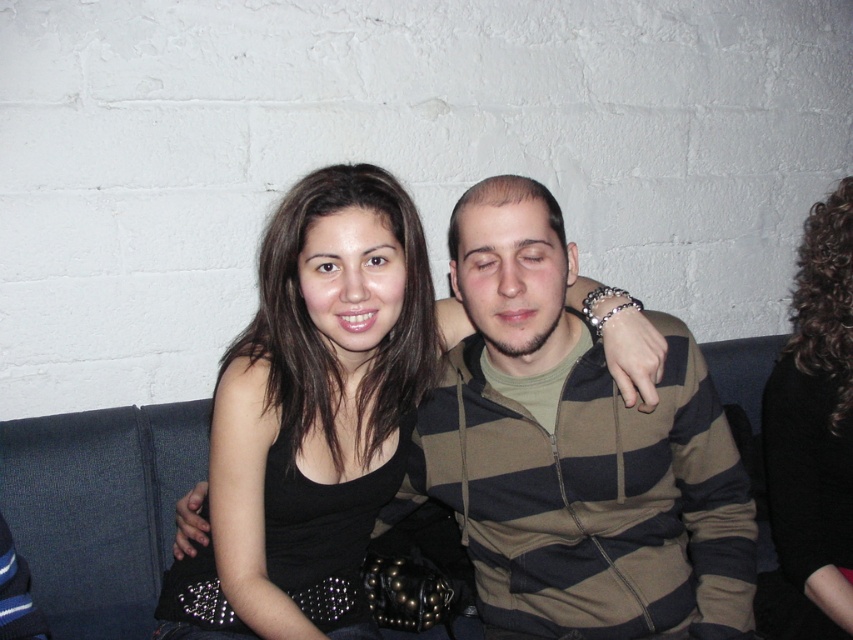
Based on the scene description, can you determine if the striped hoodie at center is wider than the black curly hair at upper right?

The striped hoodie at center is wider than black curly hair at upper right according to the objects description.

You are a photographer setting up for a photoshoot and need to decide which item to place first. Given the striped hoodie at center and the black leather gloves at center, which one requires more space due to its size?

The striped hoodie at center is bigger than the black leather gloves at center, so it requires more space due to its size.